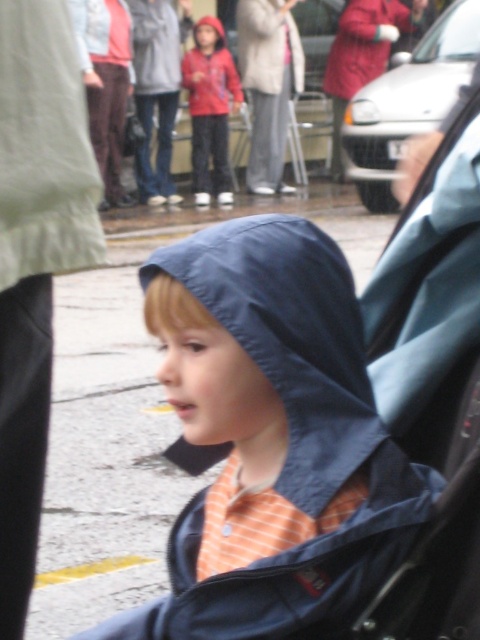
Can you confirm if matte blue jacket at center is positioned above red matte jacket at center?

Incorrect, matte blue jacket at center is not positioned above red matte jacket at center.

What do you see at coordinates (273, 438) in the screenshot? This screenshot has height=640, width=480. I see `matte blue jacket at center` at bounding box center [273, 438].

The height and width of the screenshot is (640, 480). Identify the location of matte blue jacket at center. (273, 438).